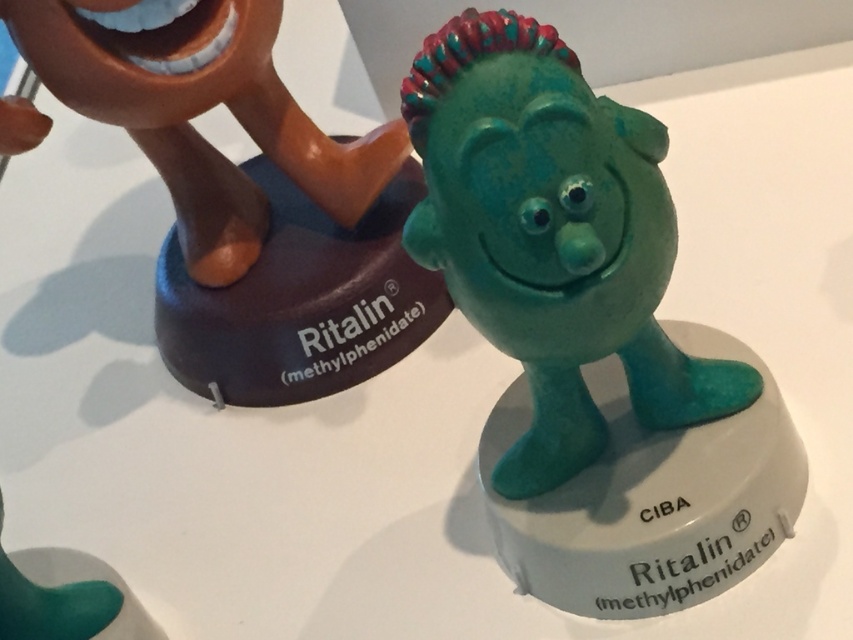
Is point (434, 252) positioned after point (242, 198)?

That is False.

At what (x,y) coordinates should I click in order to perform the action: click on teal rubber figure at center. Please return your answer as a coordinate pair (x, y). The height and width of the screenshot is (640, 853). Looking at the image, I should click on [x=552, y=236].